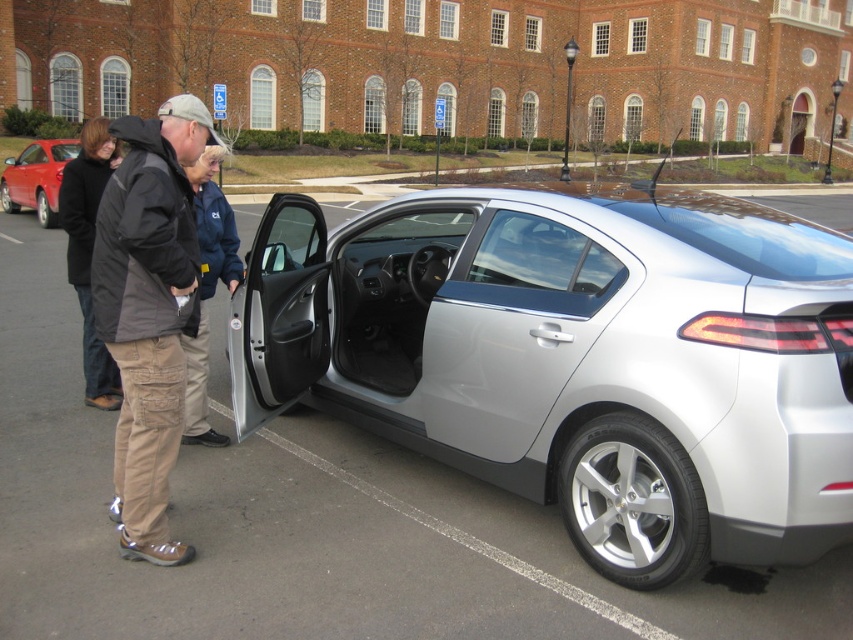
You are a delivery person who needs to place a package on the roof of the matte red sedan at left. Considering the height of the dark blue jacket at center, which is worn by a person standing nearby, can you estimate if you can reach the roof without a ladder?

The dark blue jacket at center has a lesser height compared to matte red sedan at left, meaning the person wearing it is shorter than the sedan. Since the sedan is taller than the person, you would likely need a ladder to safely reach the roof.

Based on the photo, you are standing at the center of the parking lot and see the khaki cargo pants at left. Based on their position, which direction should you walk to reach them?

The khaki cargo pants at left is located at point 0.487 on the x and 0.176 on the y. Since you are at the center, you should walk towards the left and slightly forward to reach them.

You are a fashion designer observing the two people in the parking lot. You need to determine which of the two items, the khaki cargo pants at left or the black wool coat at left, has a narrower silhouette. Which one is it?

The khaki cargo pants at left is thinner than the black wool coat at left, so the khaki cargo pants at left has a narrower silhouette.